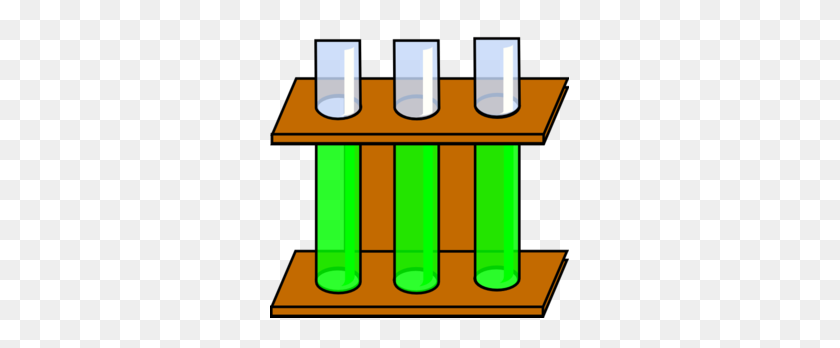
Locate an element on the screen. This screenshot has width=840, height=348. back of tube holder is located at coordinates (447, 198), (379, 198).